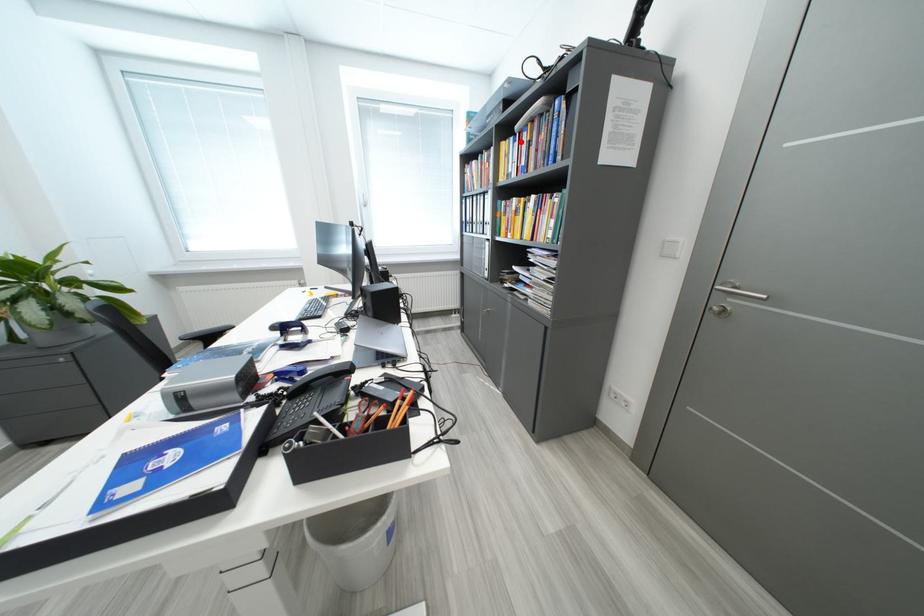
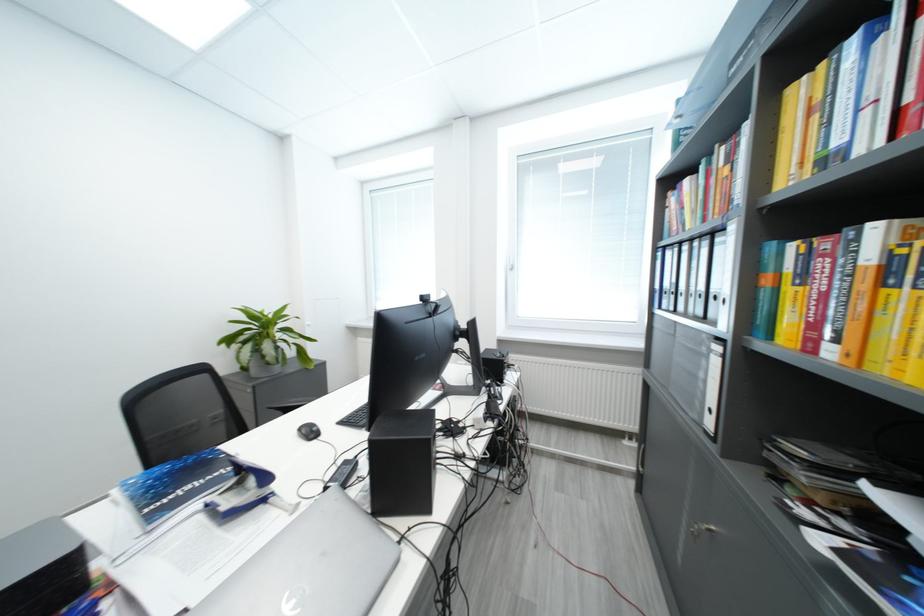
Find the pixel in the second image that matches the highlighted location in the first image.

(861, 44)